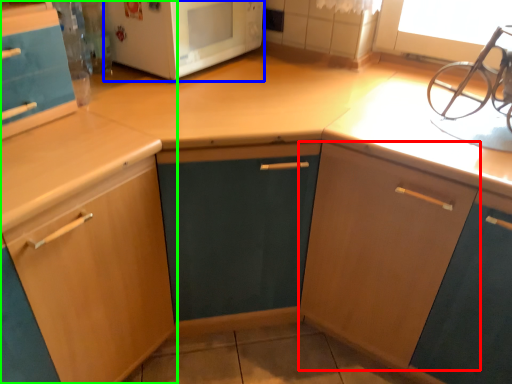
Question: Considering the real-world distances, which object is farthest from cabinetry (highlighted by a red box)? microwave oven (highlighted by a blue box) or cabinetry (highlighted by a green box)?

Choices:
 (A) microwave oven
 (B) cabinetry

Answer: (A)